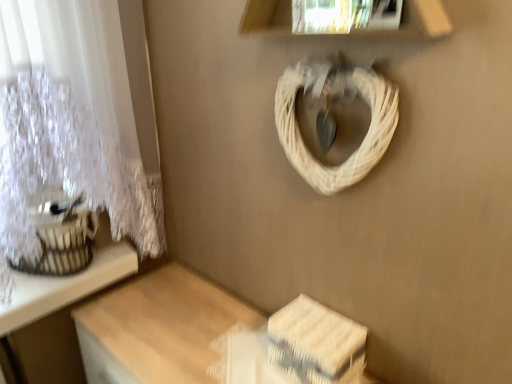
Question: Is white woven storage box at lower right not within white lace curtain at upper left?

Choices:
 (A) no
 (B) yes

Answer: (B)

Question: Does white woven storage box at lower right have a greater height compared to white lace curtain at upper left?

Choices:
 (A) yes
 (B) no

Answer: (B)

Question: Is white lace curtain at upper left surrounded by white woven storage box at lower right?

Choices:
 (A) no
 (B) yes

Answer: (A)

Question: Can you confirm if white woven storage box at lower right is thinner than white lace curtain at upper left?

Choices:
 (A) yes
 (B) no

Answer: (A)

Question: From a real-world perspective, is white woven storage box at lower right physically below white lace curtain at upper left?

Choices:
 (A) yes
 (B) no

Answer: (A)

Question: From a real-world perspective, is white lace curtain at upper left positioned above or below white wicker basket at upper center?

Choices:
 (A) below
 (B) above

Answer: (A)

Question: From the image's perspective, is white lace curtain at upper left positioned above or below white wicker basket at upper center?

Choices:
 (A) below
 (B) above

Answer: (A)

Question: From their relative heights in the image, would you say white lace curtain at upper left is taller or shorter than white wicker basket at upper center?

Choices:
 (A) tall
 (B) short

Answer: (A)

Question: Is point (17, 258) positioned closer to the camera than point (325, 190)?

Choices:
 (A) farther
 (B) closer

Answer: (A)

Question: Looking at their shapes, would you say white wicker basket at upper center is wider or thinner than wooden table at lower right?

Choices:
 (A) wide
 (B) thin

Answer: (B)

Question: From a real-world perspective, is white wicker basket at upper center positioned above or below wooden table at lower right?

Choices:
 (A) above
 (B) below

Answer: (A)

Question: Considering the positions of point (362, 86) and point (139, 355), is point (362, 86) closer or farther from the camera than point (139, 355)?

Choices:
 (A) farther
 (B) closer

Answer: (B)

Question: From their relative heights in the image, would you say white wicker basket at upper center is taller or shorter than wooden table at lower right?

Choices:
 (A) short
 (B) tall

Answer: (A)

Question: Considering the relative positions of white lace curtain at upper left and white woven storage box at lower right in the image provided, is white lace curtain at upper left to the left or to the right of white woven storage box at lower right?

Choices:
 (A) left
 (B) right

Answer: (A)

Question: Is point [102, 178] closer or farther from the camera than point [366, 334]?

Choices:
 (A) farther
 (B) closer

Answer: (A)